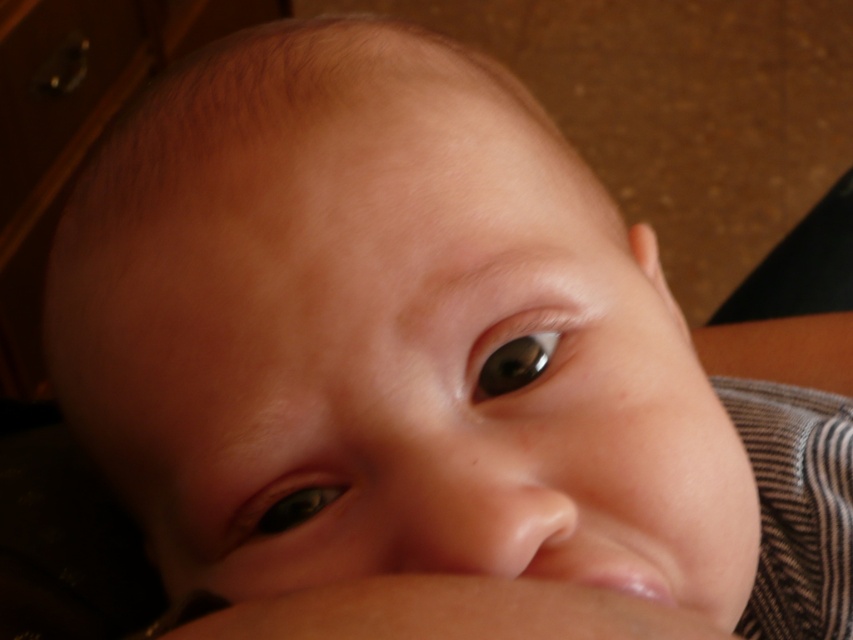
Based on the scene description, what object is located at the coordinates point [288,502]?

The green glossy eye at lower left is located at point [288,502].

You are a photographer adjusting the focus on your camera. You notice two glossy objects in the image, the green glossy eye at lower left and the brown glossy eye at upper center. Which of these two objects would require a larger aperture setting to capture its details clearly?

The green glossy eye at lower left requires a larger aperture setting because it is larger in size than the brown glossy eye at upper center, and larger objects typically need a wider aperture to ensure their details are captured clearly.

In the scene shown: Based on the scene description, which object is taller between the green glossy eye at lower left and the brown glossy eye at upper center?

The green glossy eye at lower left is taller than the brown glossy eye at upper center.